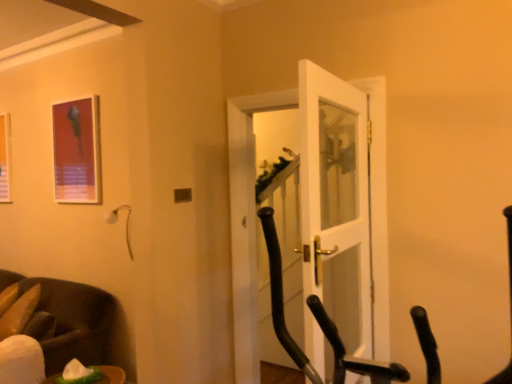
Question: Considering the positions of matte plastic picture frame at upper left, placed as the 2th picture frame when sorted from right to left, and metallic frame at upper left, which ranks as the first picture frame in right-to-left order, in the image, is matte plastic picture frame at upper left, placed as the 2th picture frame when sorted from right to left, taller or shorter than metallic frame at upper left, which ranks as the first picture frame in right-to-left order,?

Choices:
 (A) short
 (B) tall

Answer: (A)

Question: From a real-world perspective, is matte plastic picture frame at upper left, placed as the 2th picture frame when sorted from front to back, positioned above or below metallic frame at upper left, which is counted as the second picture frame, starting from the back?

Choices:
 (A) above
 (B) below

Answer: (B)

Question: Which of these objects is positioned closest to the dark brown leather chair at lower left?

Choices:
 (A) metallic frame at upper left, placed as the second picture frame when sorted from left to right
 (B) matte plastic picture frame at upper left, acting as the first picture frame starting from the back
 (C) black rubber exercise bike at center
 (D) white glossy door at center

Answer: (A)

Question: Which object is the closest to the black rubber exercise bike at center?

Choices:
 (A) white glossy door at center
 (B) metallic frame at upper left, which is counted as the second picture frame, starting from the back
 (C) dark brown leather chair at lower left
 (D) matte plastic picture frame at upper left, placed as the 2th picture frame when sorted from right to left

Answer: (A)